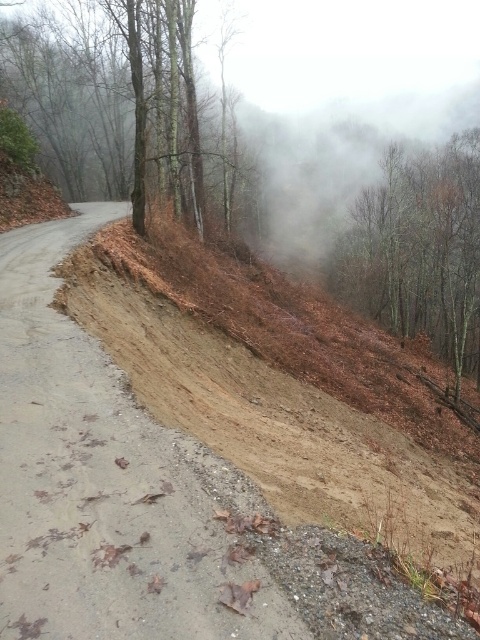
Who is taller, brown sandy dirt track at center or brown bark tree at upper center?

With more height is brown bark tree at upper center.

Is point (75, 515) positioned behind point (108, 138)?

No, (75, 515) is closer to viewer.

The image size is (480, 640). What are the coordinates of `brown sandy dirt track at center` in the screenshot? It's located at click(100, 483).

The width and height of the screenshot is (480, 640). What do you see at coordinates (123, 106) in the screenshot? I see `brown bark tree at upper center` at bounding box center [123, 106].

Does brown bark tree at upper center have a larger size compared to brown matte tree at upper right?

Indeed, brown bark tree at upper center has a larger size compared to brown matte tree at upper right.

Which is behind, point (136, 136) or point (376, 288)?

Point (376, 288)

Where is `brown bark tree at upper center`? brown bark tree at upper center is located at coordinates (123, 106).

How much distance is there between brown sandy dirt track at center and brown matte tree at upper right?

33.73 meters

Between point (145, 524) and point (467, 273), which one is positioned in front?

Point (145, 524) is more forward.

The width and height of the screenshot is (480, 640). What do you see at coordinates (100, 483) in the screenshot?
I see `brown sandy dirt track at center` at bounding box center [100, 483].

At what (x,y) coordinates should I click in order to perform the action: click on brown sandy dirt track at center. Please return your answer as a coordinate pair (x, y). The image size is (480, 640). Looking at the image, I should click on (100, 483).